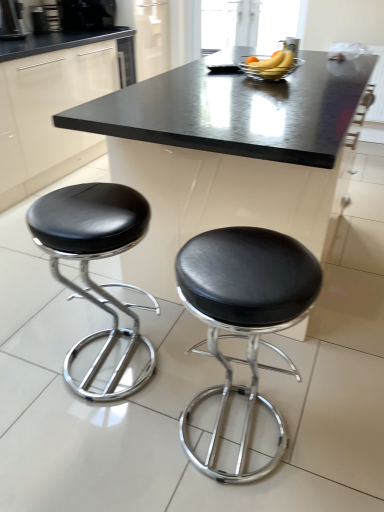
Question: From the image's perspective, is black plastic coffee machine at upper left, which appears as the 1th coffee machine when viewed from the left, above or below black leather stool at lower right, marked as the 2th stool in a left-to-right arrangement?

Choices:
 (A) below
 (B) above

Answer: (B)

Question: From a real-world perspective, relative to black leather stool at lower right, marked as the 2th stool in a left-to-right arrangement, is black plastic coffee machine at upper left, the first coffee machine positioned from the bottom, vertically above or below?

Choices:
 (A) below
 (B) above

Answer: (B)

Question: Estimate the real-world distances between objects in this image. Which object is farther from the black leather stool at left, the 2th stool in the right-to-left sequence?

Choices:
 (A) metallic silver coffee maker at upper left, the 1th appliance from the left
 (B) black plastic coffee machine at upper left, which appears as the 1th coffee machine when viewed from the left
 (C) black marble table at center
 (D) yellow matte banana at upper center
 (E) brushed metal coffee maker at upper left, which is the 1th appliance in right-to-left order

Answer: (E)

Question: Based on their relative distances, which object is farther from the black leather stool at left, the 2th stool in the right-to-left sequence?

Choices:
 (A) black plastic coffee machine at upper left, which appears as the 1th coffee machine when viewed from the left
 (B) yellow matte banana at upper center
 (C) black marble table at center
 (D) black leather stool at lower right, marked as the 2th stool in a left-to-right arrangement
 (E) brushed metal coffee maker at upper left, which is the second appliance from left to right

Answer: (E)